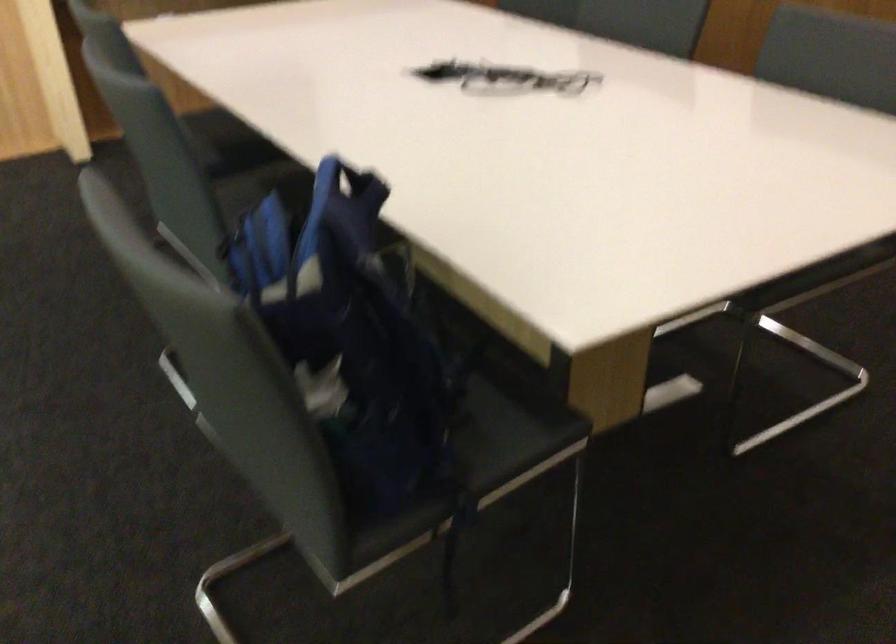
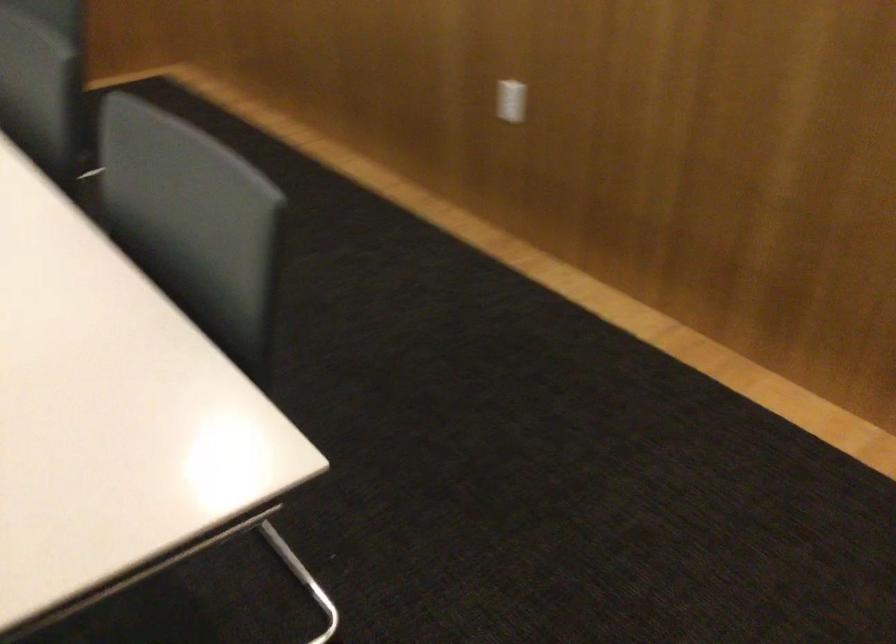
The images are taken continuously from a first-person perspective. In which direction are you moving?

The cameraman moved toward right, forward.